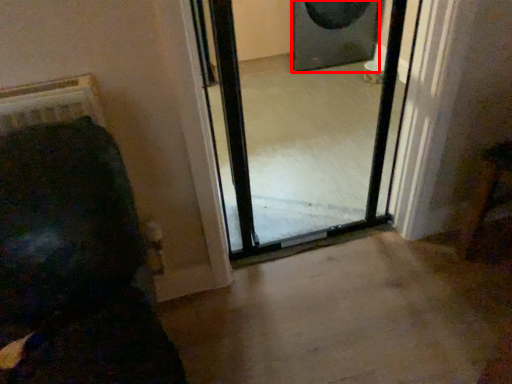
Question: From the image's perspective, what is the correct spatial positioning of speaker (annotated by the red box) in reference to screen door?

Choices:
 (A) below
 (B) above

Answer: (B)